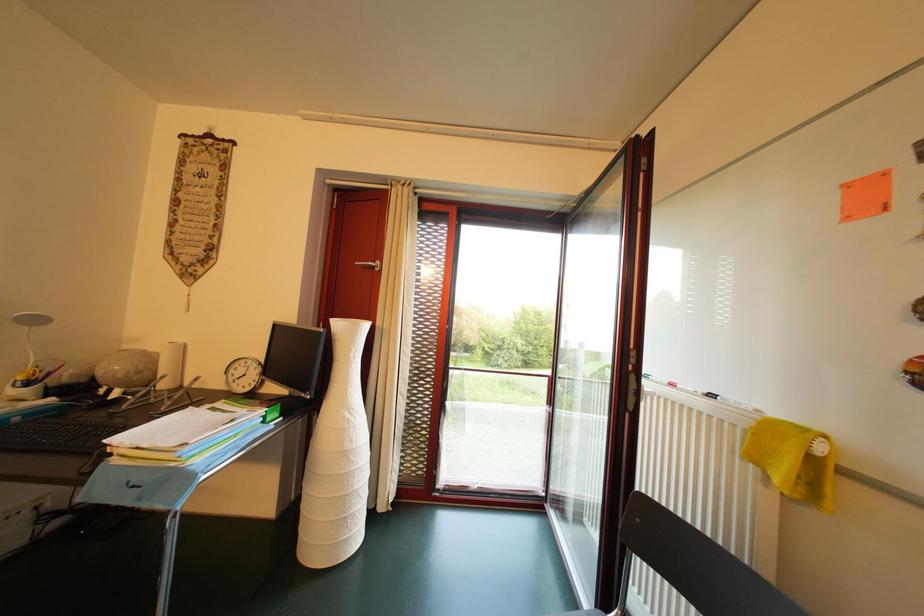
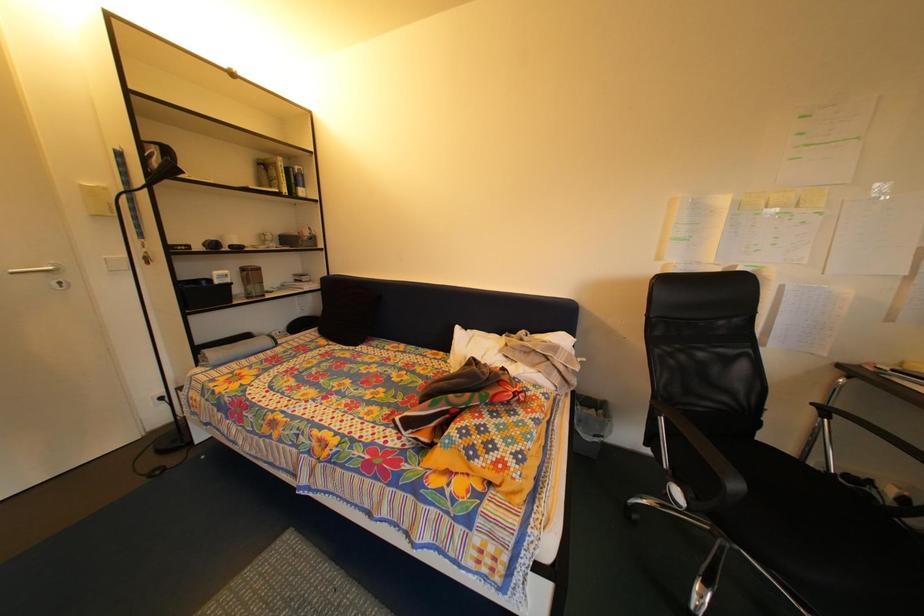
Question: The first image is from the beginning of the video and the second image is from the end. How did the camera likely rotate when shooting the video?

Choices:
 (A) Left
 (B) Right
 (C) Up
 (D) Down

Answer: (A)